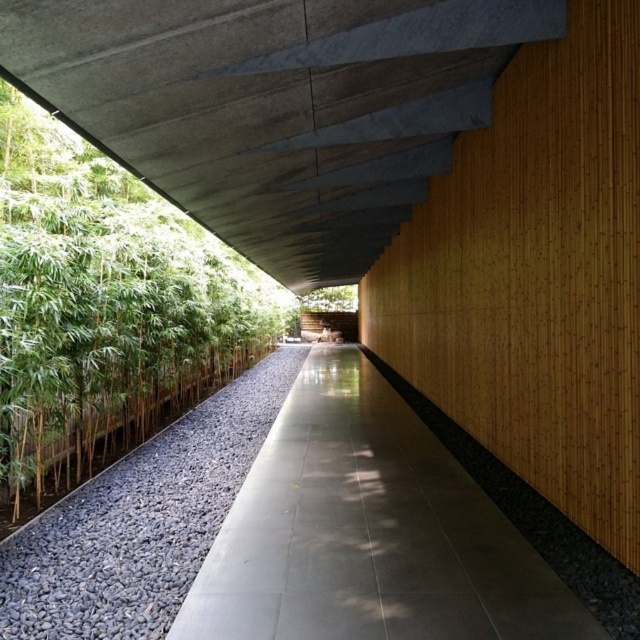
You are standing at the entrance of the walkway and want to reach the gravel bed on one side. Which direction should you turn to face the gray concrete path at center and the green leafy tree at center?

You should turn to your left to face the gray concrete path at center, which is to the left of the green leafy tree at center.

From the picture: You are standing at the entrance of the covered walkway and need to reach the gravel bed on one side. Which direction should you move relative to the gray concrete path at center?

The gray concrete path at center is located at point (369, 532). Since the gravel bed is on one side of the walkway, you should move away from the gray concrete path at center towards the side where the gravel bed is located.

From the picture: You are a maintenance worker checking the walkway. You notice the gray concrete path at center and the black gravel at center. Which one is positioned higher in elevation?

The gray concrete path at center is located above the black gravel at center, so it is positioned higher in elevation.